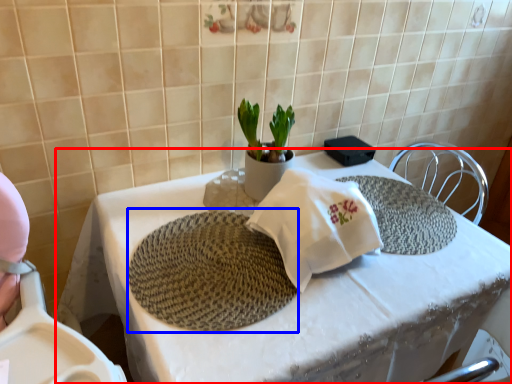
Question: Which object appears closest to the camera in this image, table (highlighted by a red box) or mat (highlighted by a blue box)?

Choices:
 (A) table
 (B) mat

Answer: (A)